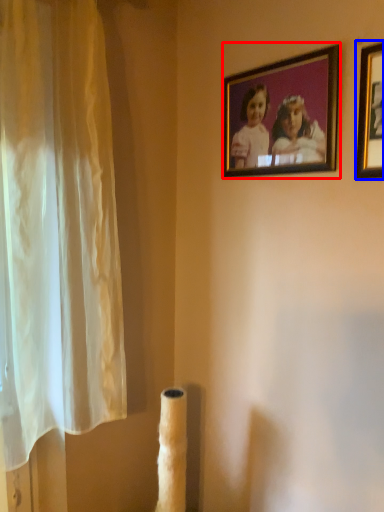
Question: Which object appears closest to the camera in this image, picture frame (highlighted by a red box) or picture frame (highlighted by a blue box)?

Choices:
 (A) picture frame
 (B) picture frame

Answer: (B)